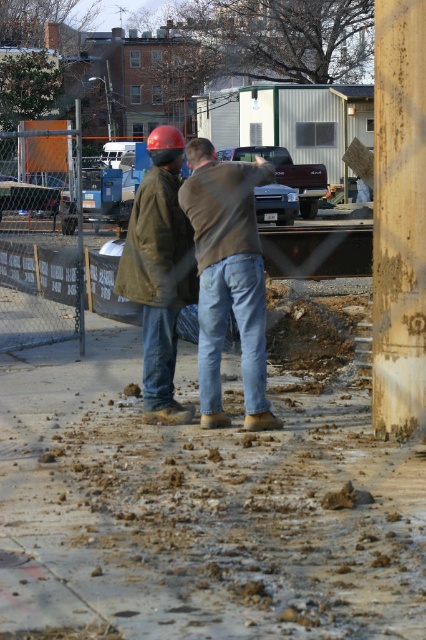
Question: Which point is farther to the camera?

Choices:
 (A) wooden pole at center right
 (B) muddy concrete at center

Answer: (B)

Question: Can you confirm if wooden pole at center right is smaller than orange chain-link fence at left?

Choices:
 (A) no
 (B) yes

Answer: (B)

Question: Does wooden pole at center right lie in front of orange chain-link fence at left?

Choices:
 (A) no
 (B) yes

Answer: (B)

Question: Estimate the real-world distances between objects in this image. Which object is farther from the muddy concrete at center?

Choices:
 (A) orange chain-link fence at left
 (B) brown leather jacket at center
 (C) wooden pole at center right

Answer: (A)

Question: Which is farther from the brown leather jacket at center?

Choices:
 (A) muddy concrete at center
 (B) orange chain-link fence at left

Answer: (B)

Question: Is wooden pole at center right wider than matte brown jacket at center?

Choices:
 (A) no
 (B) yes

Answer: (A)